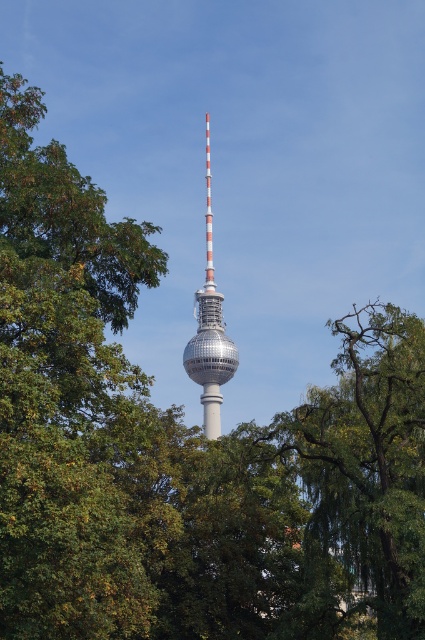
Does green leafy tree at center appear under shiny metallic tower at center?

Indeed, green leafy tree at center is positioned under shiny metallic tower at center.

Is green leafy tree at center above shiny metallic tower at center?

No, green leafy tree at center is not above shiny metallic tower at center.

At what (x,y) coordinates should I click in order to perform the action: click on green leafy tree at center. Please return your answer as a coordinate pair (x, y). The width and height of the screenshot is (425, 640). Looking at the image, I should click on tap(354, 481).